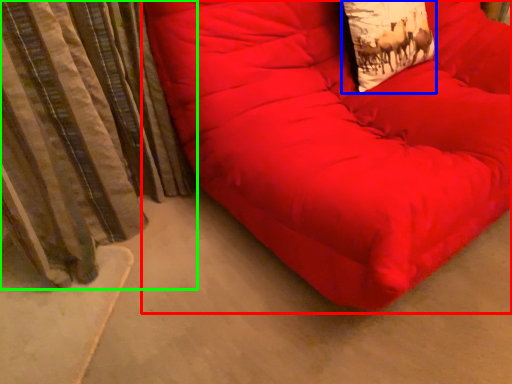
Question: Which is farther away from furniture (highlighted by a red box)? throw pillow (highlighted by a blue box) or curtain (highlighted by a green box)?

Choices:
 (A) throw pillow
 (B) curtain

Answer: (B)